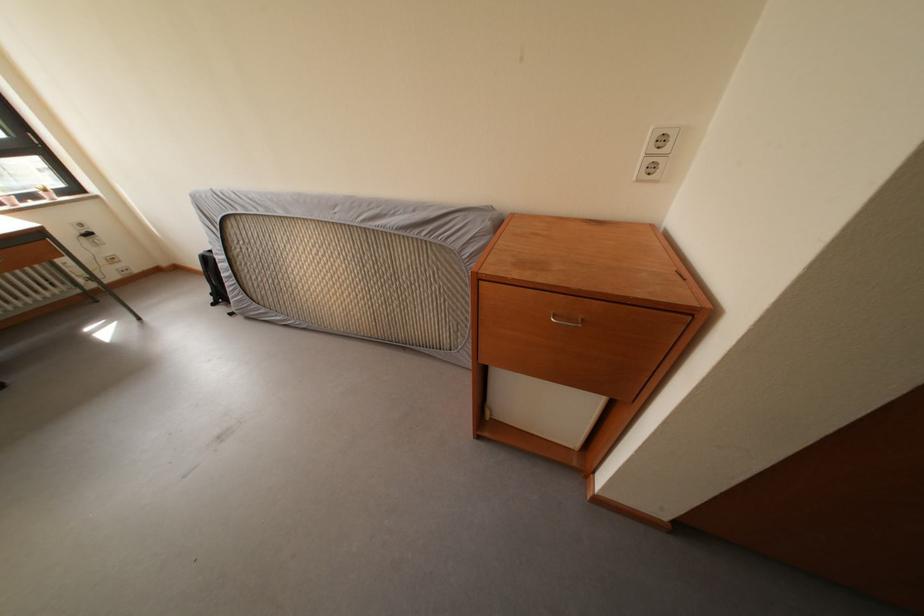
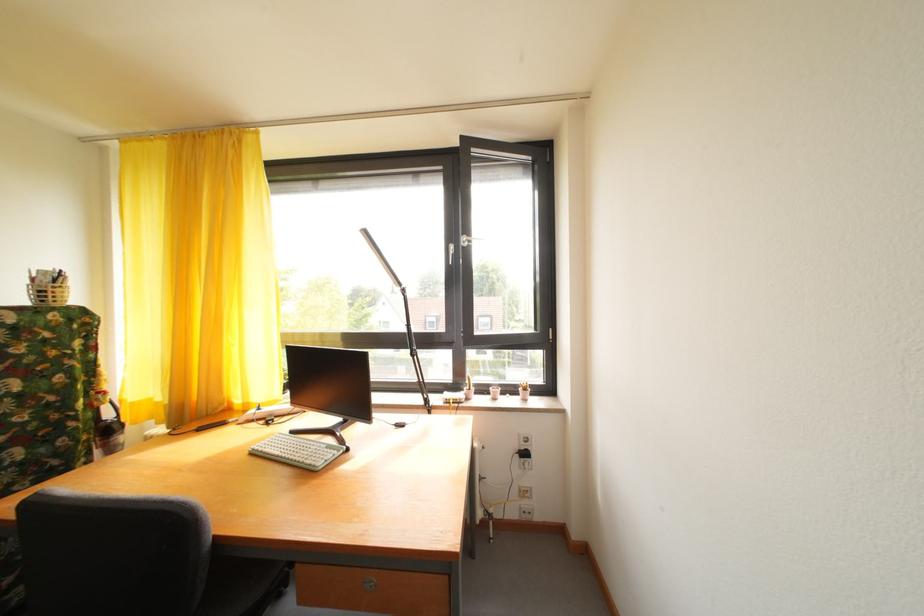
Locate, in the second image, the point that corresponds to [41,204] in the first image.

(520, 395)